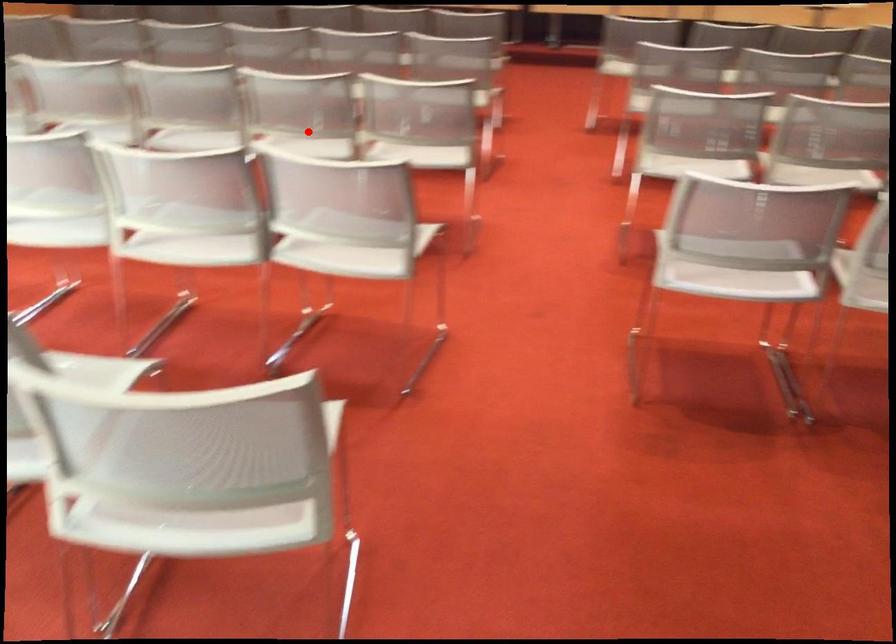
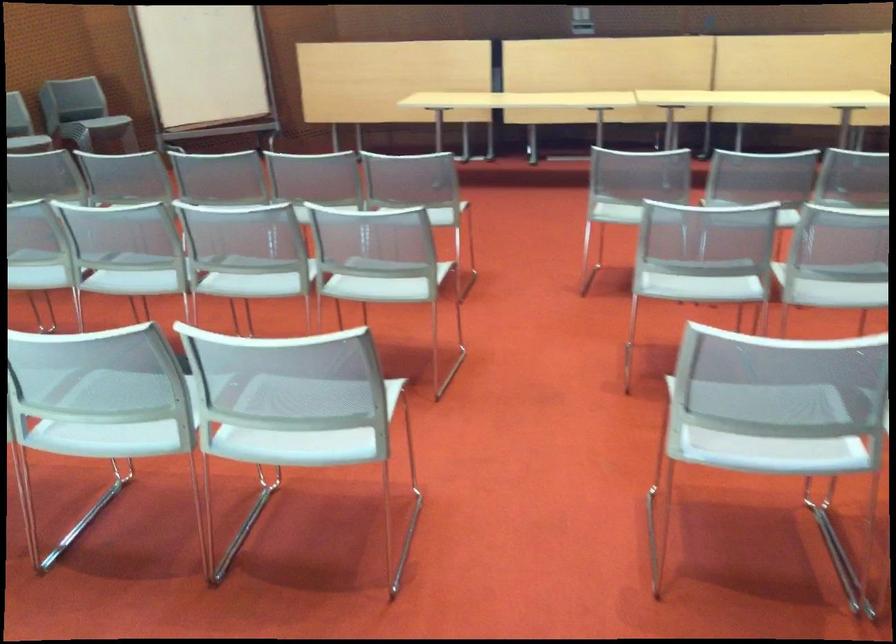
The point at the highlighted location is marked in the first image. Where is the corresponding point in the second image?

(113, 412)